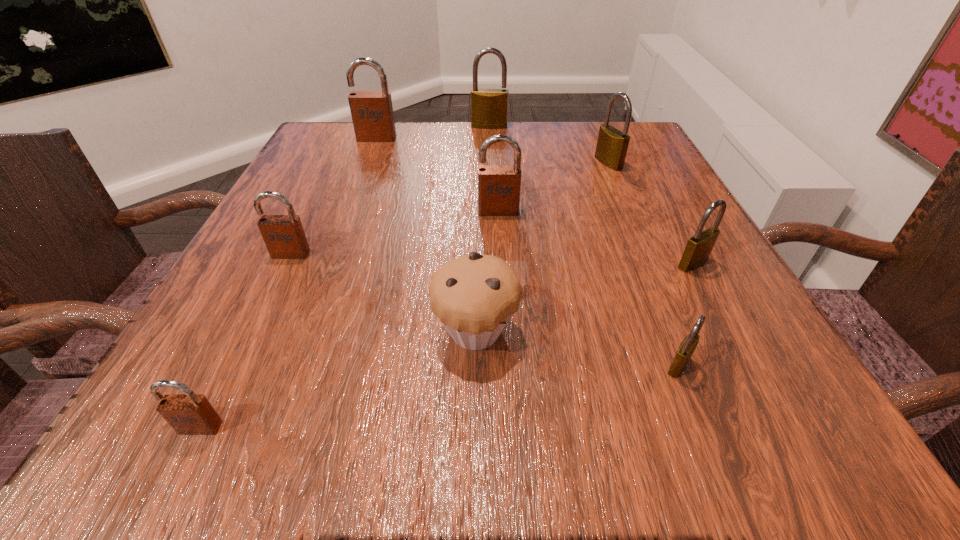
Find the location of a particular element. The width and height of the screenshot is (960, 540). brass padlock that is the second closest one to the third biggest brown padlock is located at coordinates (687, 347).

Identify which brown padlock is the closest to the leftmost brass padlock. Please provide its 2D coordinates. Your answer should be formatted as a tuple, i.e. [(x, y)], where the tuple contains the x and y coordinates of a point satisfying the conditions above.

[(372, 114)]

Identify which brown padlock is the closest to the second farthest object. Please provide its 2D coordinates. Your answer should be formatted as a tuple, i.e. [(x, y)], where the tuple contains the x and y coordinates of a point satisfying the conditions above.

[(499, 186)]

The width and height of the screenshot is (960, 540). Identify the location of vacant space that satisfies the following two spatial constraints: 1. on the front-facing side of the muffin; 2. on the left side of the third farthest brown padlock. (253, 332).

Where is `vacant space that satisfies the following two spatial constraints: 1. on the front side of the second nearest padlock; 2. on the left side of the muffin`? vacant space that satisfies the following two spatial constraints: 1. on the front side of the second nearest padlock; 2. on the left side of the muffin is located at coordinates (476, 366).